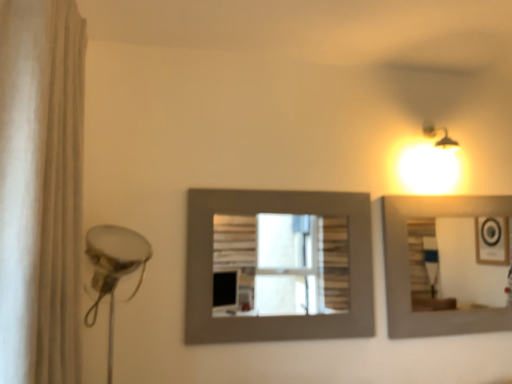
The image size is (512, 384). Describe the element at coordinates (40, 190) in the screenshot. I see `white fabric shower curtain at left` at that location.

At what (x,y) coordinates should I click in order to perform the action: click on white fabric shower curtain at left. Please return your answer as a coordinate pair (x, y). The image size is (512, 384). Looking at the image, I should click on (40, 190).

At what (x,y) coordinates should I click in order to perform the action: click on matte gray picture frame at center. Please return your answer as a coordinate pair (x, y). The height and width of the screenshot is (384, 512). Looking at the image, I should click on (282, 316).

Describe the element at coordinates (282, 316) in the screenshot. This screenshot has width=512, height=384. I see `matte gray picture frame at center` at that location.

This screenshot has width=512, height=384. Identify the location of white fabric shower curtain at left. (40, 190).

Does matte gray picture frame at center appear on the left side of white fabric shower curtain at left?

In fact, matte gray picture frame at center is to the right of white fabric shower curtain at left.

In the image, is matte gray picture frame at center positioned in front of or behind white fabric shower curtain at left?

Clearly, matte gray picture frame at center is behind white fabric shower curtain at left.

Considering the positions of point (192, 301) and point (48, 148), is point (192, 301) closer or farther from the camera than point (48, 148)?

Point (192, 301) appears to be farther away from the viewer than point (48, 148).

From the image's perspective, does matte gray picture frame at center appear lower than white fabric shower curtain at left?

Indeed, from the image's perspective, matte gray picture frame at center is shown beneath white fabric shower curtain at left.

From a real-world perspective, is matte gray picture frame at center physically above white fabric shower curtain at left?

Actually, matte gray picture frame at center is physically below white fabric shower curtain at left in the real world.

Which of these two, matte gray picture frame at center or white fabric shower curtain at left, is wider?

With larger width is white fabric shower curtain at left.

Between matte gray picture frame at center and white fabric shower curtain at left, which one has less height?

With less height is matte gray picture frame at center.

Can you confirm if matte gray picture frame at center is bigger than white fabric shower curtain at left?

No, matte gray picture frame at center is not bigger than white fabric shower curtain at left.

Is matte gray picture frame at center not inside white fabric shower curtain at left?

Absolutely, matte gray picture frame at center is external to white fabric shower curtain at left.

Can you see matte gray picture frame at center touching white fabric shower curtain at left?

They are not placed beside each other.

Is matte gray picture frame at center oriented away from white fabric shower curtain at left?

matte gray picture frame at center does not have its back to white fabric shower curtain at left.

What's the angular difference between matte gray picture frame at center and white fabric shower curtain at left's facing directions?

89.1 degrees.

I want to click on shower curtain above the matte gray picture frame at center (from a real-world perspective), so click(x=40, y=190).

From the picture: Considering the relative positions of white fabric shower curtain at left and matte gray picture frame at center in the image provided, is white fabric shower curtain at left to the left or to the right of matte gray picture frame at center?

Clearly, white fabric shower curtain at left is on the left of matte gray picture frame at center in the image.

Which object is further away from the camera, white fabric shower curtain at left or matte gray picture frame at center?

matte gray picture frame at center is further away from the camera.

Is point (58, 162) less distant than point (372, 314)?

That is True.

From the image's perspective, would you say white fabric shower curtain at left is shown under matte gray picture frame at center?

No, from the image's perspective, white fabric shower curtain at left is not beneath matte gray picture frame at center.

From a real-world perspective, is white fabric shower curtain at left positioned above or below matte gray picture frame at center?

From a real-world perspective, white fabric shower curtain at left is physically above matte gray picture frame at center.

Considering the relative sizes of white fabric shower curtain at left and matte gray picture frame at center in the image provided, is white fabric shower curtain at left thinner than matte gray picture frame at center?

No, white fabric shower curtain at left is not thinner than matte gray picture frame at center.

Considering the relative sizes of white fabric shower curtain at left and matte gray picture frame at center in the image provided, is white fabric shower curtain at left shorter than matte gray picture frame at center?

No.

Who is bigger, white fabric shower curtain at left or matte gray picture frame at center?

white fabric shower curtain at left.

Is white fabric shower curtain at left inside or outside of matte gray picture frame at center?

The correct answer is: outside.

Is white fabric shower curtain at left directly adjacent to matte gray picture frame at center?

No, white fabric shower curtain at left is not next to matte gray picture frame at center.

Could you tell me if white fabric shower curtain at left is turned towards matte gray picture frame at center?

No, white fabric shower curtain at left is not facing towards matte gray picture frame at center.

Measure the distance between white fabric shower curtain at left and matte gray picture frame at center.

white fabric shower curtain at left is 1.06 meters from matte gray picture frame at center.

In order to click on picture frame below the white fabric shower curtain at left (from the image's perspective) in this screenshot , I will do `click(282, 316)`.

Where is `shower curtain to the left of matte gray picture frame at center`? shower curtain to the left of matte gray picture frame at center is located at coordinates (40, 190).

Locate an element on the screen. Image resolution: width=512 pixels, height=384 pixels. picture frame below the white fabric shower curtain at left (from the image's perspective) is located at coordinates coord(282,316).